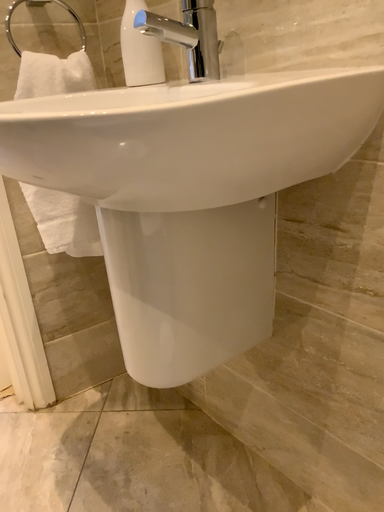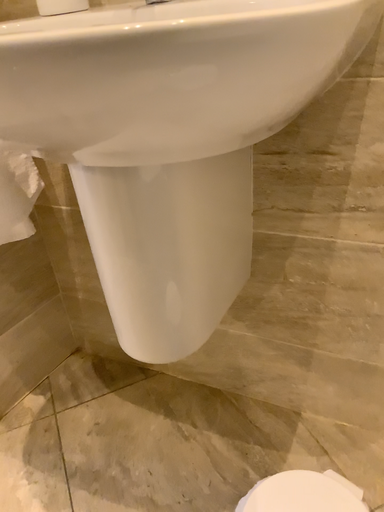
Question: Which way did the camera rotate in the video?

Choices:
 (A) rotated right
 (B) rotated left

Answer: (A)